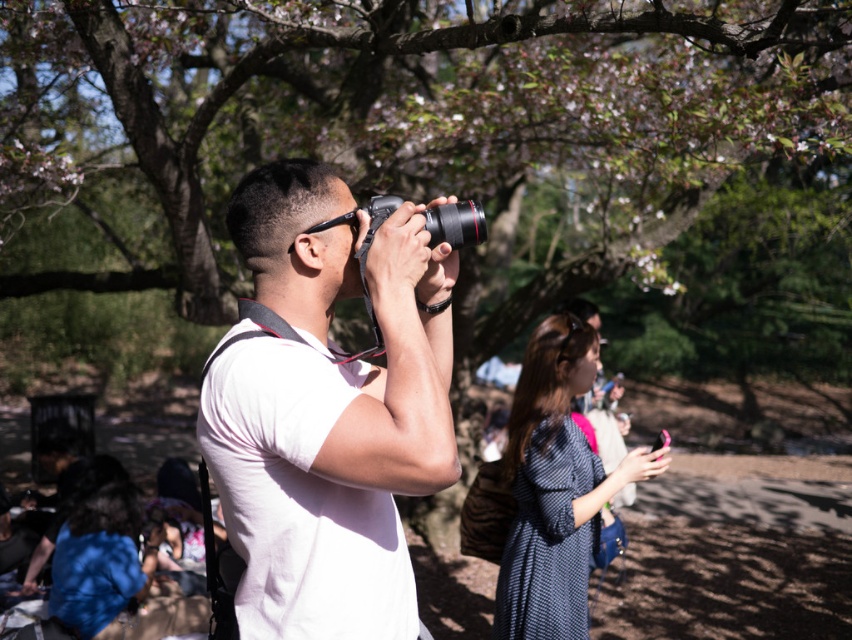
Question: Considering the relative positions of white matte camera at center and dark blue textured dress at center in the image provided, where is white matte camera at center located with respect to dark blue textured dress at center?

Choices:
 (A) below
 (B) above

Answer: (B)

Question: Is white matte camera at center thinner than black plastic camera at center?

Choices:
 (A) no
 (B) yes

Answer: (A)

Question: Which of the following is the farthest from the observer?

Choices:
 (A) (651, 474)
 (B) (475, 205)

Answer: (A)

Question: Which of the following is the closest to the observer?

Choices:
 (A) white matte camera at center
 (B) dark blue textured dress at center
 (C) black plastic camera at center

Answer: (A)

Question: Which point appears closest to the camera in this image?

Choices:
 (A) (444, 237)
 (B) (303, 490)
 (C) (561, 512)

Answer: (B)

Question: Can you confirm if dark blue textured dress at center is wider than black plastic camera at center?

Choices:
 (A) no
 (B) yes

Answer: (B)